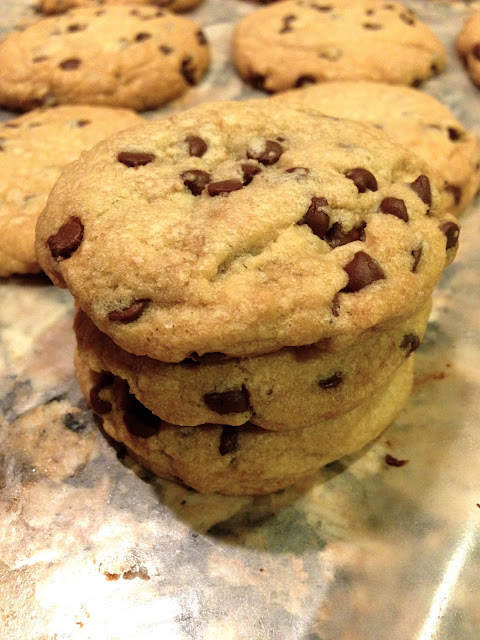
In order to click on blank space on bottom of counter in this screenshot , I will do `click(212, 604)`.